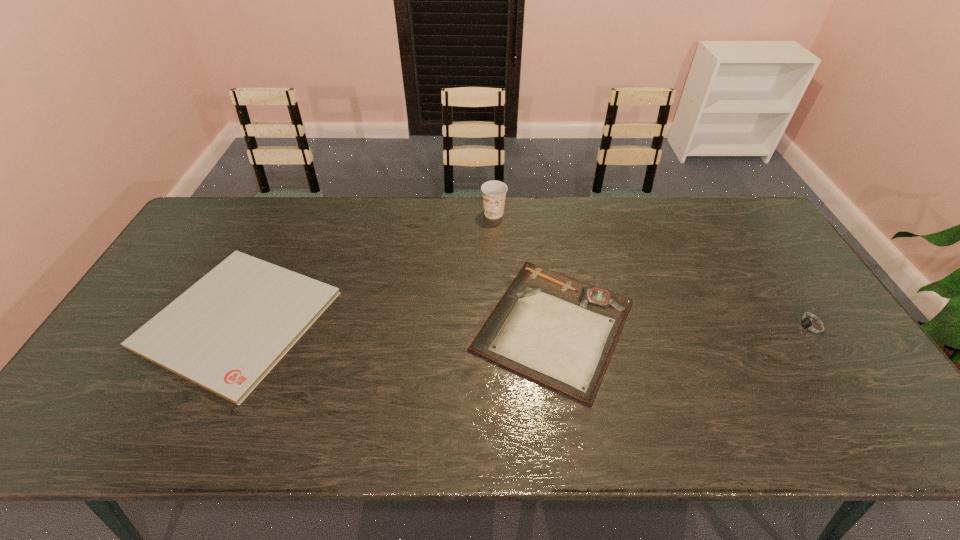
Find the location of a particular element. This screenshot has height=540, width=960. free space located 0.170m on the back of the right clipboard is located at coordinates (540, 228).

Find the location of a particular element. This screenshot has height=540, width=960. vacant point located 0.210m on the right of the leftmost object is located at coordinates (410, 319).

The image size is (960, 540). Find the location of `object that is at the far edge`. object that is at the far edge is located at coordinates (493, 192).

Where is `object located at the left edge`? object located at the left edge is located at coordinates (225, 333).

Locate an element on the screen. object at the right edge is located at coordinates (809, 325).

Image resolution: width=960 pixels, height=540 pixels. What are the coordinates of `free space at the far edge of the desktop` in the screenshot? It's located at (698, 207).

The height and width of the screenshot is (540, 960). I want to click on free location at the near edge of the desktop, so click(x=829, y=440).

Locate an element on the screen. vacant space at the left edge of the desktop is located at coordinates (142, 400).

Where is `free location at the right edge`? free location at the right edge is located at coordinates point(878,402).

The height and width of the screenshot is (540, 960). In order to click on vacant region at the near left corner of the desktop in this screenshot , I will do `click(76, 435)`.